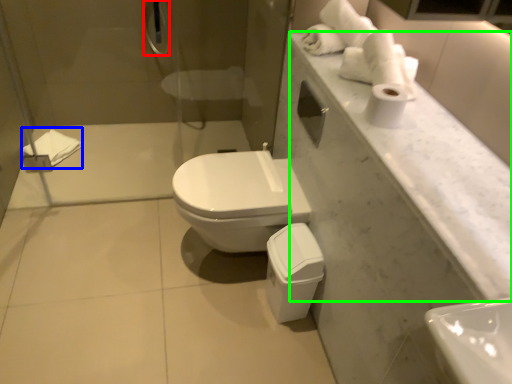
Question: Based on their relative distances, which object is nearer to shower (highlighted by a red box)? Choose from bath towel (highlighted by a blue box) and counter top (highlighted by a green box).

Choices:
 (A) bath towel
 (B) counter top

Answer: (A)